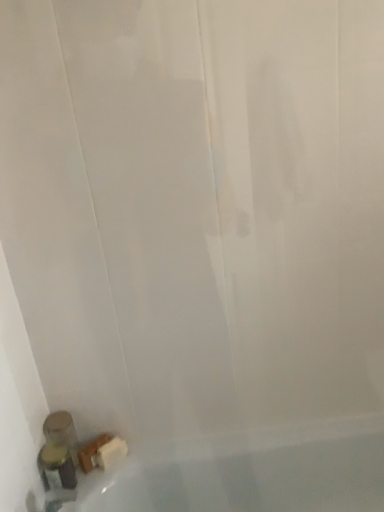
What is the approximate width of metallic silver soap dispenser at lower left, the 2th toiletry when ordered from back to front?

It is 3.17 inches.

What do you see at coordinates (57, 472) in the screenshot?
I see `metallic silver soap dispenser at lower left, the 2th toiletry when ordered from back to front` at bounding box center [57, 472].

Find the location of a particular element. metallic silver soap dispenser at lower left, placed as the first toiletry when sorted from front to back is located at coordinates (57, 472).

The height and width of the screenshot is (512, 384). Describe the element at coordinates (61, 432) in the screenshot. I see `translucent plastic soap at lower left, the second toiletry positioned from the front` at that location.

Measure the distance between point (51, 420) and camera.

Point (51, 420) and camera are 3.85 feet apart.

Where is `translucent plastic soap at lower left, which is the 1th toiletry in back-to-front order`? translucent plastic soap at lower left, which is the 1th toiletry in back-to-front order is located at coordinates (61, 432).

The width and height of the screenshot is (384, 512). I want to click on metallic silver soap dispenser at lower left, placed as the first toiletry when sorted from front to back, so click(57, 472).

In the image, is metallic silver soap dispenser at lower left, the 2th toiletry when ordered from back to front, on the left side or the right side of translucent plastic soap at lower left, which is the 1th toiletry in back-to-front order?

metallic silver soap dispenser at lower left, the 2th toiletry when ordered from back to front, is positioned on translucent plastic soap at lower left, which is the 1th toiletry in back-to-front order,'s right side.

Is the depth of metallic silver soap dispenser at lower left, the 2th toiletry when ordered from back to front, less than that of translucent plastic soap at lower left, which is the 1th toiletry in back-to-front order?

Yes.

Considering the points (69, 454) and (53, 438), which point is behind, point (69, 454) or point (53, 438)?

The point (69, 454) is more distant.

From the image's perspective, who appears lower, metallic silver soap dispenser at lower left, the 2th toiletry when ordered from back to front, or translucent plastic soap at lower left, the second toiletry positioned from the front?

metallic silver soap dispenser at lower left, the 2th toiletry when ordered from back to front, from the image's perspective.

From a real-world perspective, is metallic silver soap dispenser at lower left, placed as the first toiletry when sorted from front to back, positioned under translucent plastic soap at lower left, which is the 1th toiletry in back-to-front order, based on gravity?

Yes, from a real-world perspective, metallic silver soap dispenser at lower left, placed as the first toiletry when sorted from front to back, is beneath translucent plastic soap at lower left, which is the 1th toiletry in back-to-front order.

Which object is thinner, metallic silver soap dispenser at lower left, the 2th toiletry when ordered from back to front, or translucent plastic soap at lower left, which is the 1th toiletry in back-to-front order?

With smaller width is metallic silver soap dispenser at lower left, the 2th toiletry when ordered from back to front.

Which of these two, metallic silver soap dispenser at lower left, placed as the first toiletry when sorted from front to back, or translucent plastic soap at lower left, which is the 1th toiletry in back-to-front order, stands shorter?

With less height is metallic silver soap dispenser at lower left, placed as the first toiletry when sorted from front to back.

Can you confirm if metallic silver soap dispenser at lower left, the 2th toiletry when ordered from back to front, is bigger than translucent plastic soap at lower left, which is the 1th toiletry in back-to-front order?

Incorrect, metallic silver soap dispenser at lower left, the 2th toiletry when ordered from back to front, is not larger than translucent plastic soap at lower left, which is the 1th toiletry in back-to-front order.

Is translucent plastic soap at lower left, which is the 1th toiletry in back-to-front order, inside metallic silver soap dispenser at lower left, placed as the first toiletry when sorted from front to back?

No, metallic silver soap dispenser at lower left, placed as the first toiletry when sorted from front to back, does not contain translucent plastic soap at lower left, which is the 1th toiletry in back-to-front order.

Is metallic silver soap dispenser at lower left, the 2th toiletry when ordered from back to front, placed right next to translucent plastic soap at lower left, which is the 1th toiletry in back-to-front order?

Yes, metallic silver soap dispenser at lower left, the 2th toiletry when ordered from back to front, is beside translucent plastic soap at lower left, which is the 1th toiletry in back-to-front order.

Is metallic silver soap dispenser at lower left, the 2th toiletry when ordered from back to front, facing away from translucent plastic soap at lower left, the second toiletry positioned from the front?

No, translucent plastic soap at lower left, the second toiletry positioned from the front, is not at the back of metallic silver soap dispenser at lower left, the 2th toiletry when ordered from back to front.

Locate an element on the screen. This screenshot has width=384, height=512. toiletry on the left of metallic silver soap dispenser at lower left, the 2th toiletry when ordered from back to front is located at coordinates pyautogui.click(x=61, y=432).

Considering the relative positions of translucent plastic soap at lower left, which is the 1th toiletry in back-to-front order, and metallic silver soap dispenser at lower left, the 2th toiletry when ordered from back to front, in the image provided, is translucent plastic soap at lower left, which is the 1th toiletry in back-to-front order, to the left of metallic silver soap dispenser at lower left, the 2th toiletry when ordered from back to front, from the viewer's perspective?

Indeed, translucent plastic soap at lower left, which is the 1th toiletry in back-to-front order, is positioned on the left side of metallic silver soap dispenser at lower left, the 2th toiletry when ordered from back to front.

Considering the positions of objects translucent plastic soap at lower left, which is the 1th toiletry in back-to-front order, and metallic silver soap dispenser at lower left, the 2th toiletry when ordered from back to front, in the image provided, who is in front, translucent plastic soap at lower left, which is the 1th toiletry in back-to-front order, or metallic silver soap dispenser at lower left, the 2th toiletry when ordered from back to front,?

metallic silver soap dispenser at lower left, the 2th toiletry when ordered from back to front, is closer to the camera.

Does point (74, 434) come closer to viewer compared to point (47, 469)?

That is False.

From the image's perspective, is translucent plastic soap at lower left, the second toiletry positioned from the front, below metallic silver soap dispenser at lower left, the 2th toiletry when ordered from back to front?

Incorrect, from the image's perspective, translucent plastic soap at lower left, the second toiletry positioned from the front, is higher than metallic silver soap dispenser at lower left, the 2th toiletry when ordered from back to front.

From a real-world perspective, between translucent plastic soap at lower left, the second toiletry positioned from the front, and metallic silver soap dispenser at lower left, the 2th toiletry when ordered from back to front, who is vertically lower?

metallic silver soap dispenser at lower left, the 2th toiletry when ordered from back to front, from a real-world perspective.

Can you confirm if translucent plastic soap at lower left, which is the 1th toiletry in back-to-front order, is wider than metallic silver soap dispenser at lower left, the 2th toiletry when ordered from back to front?

Yes, translucent plastic soap at lower left, which is the 1th toiletry in back-to-front order, is wider than metallic silver soap dispenser at lower left, the 2th toiletry when ordered from back to front.

Can you confirm if translucent plastic soap at lower left, which is the 1th toiletry in back-to-front order, is taller than metallic silver soap dispenser at lower left, the 2th toiletry when ordered from back to front?

Yes, translucent plastic soap at lower left, which is the 1th toiletry in back-to-front order, is taller than metallic silver soap dispenser at lower left, the 2th toiletry when ordered from back to front.

Is translucent plastic soap at lower left, the second toiletry positioned from the front, bigger than metallic silver soap dispenser at lower left, the 2th toiletry when ordered from back to front?

Yes, translucent plastic soap at lower left, the second toiletry positioned from the front, is bigger than metallic silver soap dispenser at lower left, the 2th toiletry when ordered from back to front.

Which is correct: translucent plastic soap at lower left, which is the 1th toiletry in back-to-front order, is inside metallic silver soap dispenser at lower left, placed as the first toiletry when sorted from front to back, or outside of it?

The correct answer is: outside.

Is translucent plastic soap at lower left, the second toiletry positioned from the front, not near metallic silver soap dispenser at lower left, placed as the first toiletry when sorted from front to back?

No, there isn't a large distance between translucent plastic soap at lower left, the second toiletry positioned from the front, and metallic silver soap dispenser at lower left, placed as the first toiletry when sorted from front to back.

From the picture: Is translucent plastic soap at lower left, the second toiletry positioned from the front, facing away from metallic silver soap dispenser at lower left, placed as the first toiletry when sorted from front to back?

No, metallic silver soap dispenser at lower left, placed as the first toiletry when sorted from front to back, is not at the back of translucent plastic soap at lower left, the second toiletry positioned from the front.

How many degrees apart are the facing directions of translucent plastic soap at lower left, which is the 1th toiletry in back-to-front order, and metallic silver soap dispenser at lower left, placed as the first toiletry when sorted from front to back?

The angle between the facing direction of translucent plastic soap at lower left, which is the 1th toiletry in back-to-front order, and the facing direction of metallic silver soap dispenser at lower left, placed as the first toiletry when sorted from front to back, is 1.16 degrees.

Locate an element on the screen. toiletry below the translucent plastic soap at lower left, which is the 1th toiletry in back-to-front order (from the image's perspective) is located at coordinates (57, 472).

Locate an element on the screen. The height and width of the screenshot is (512, 384). toiletry above the metallic silver soap dispenser at lower left, the 2th toiletry when ordered from back to front (from a real-world perspective) is located at coordinates (61, 432).

You are a GUI agent. You are given a task and a screenshot of the screen. Output one action in this format:
    pyautogui.click(x=<x>, y=<y>)
    Task: Click on the toiletry that is behind the metallic silver soap dispenser at lower left, the 2th toiletry when ordered from back to front
    
    Given the screenshot: What is the action you would take?
    tap(61, 432)